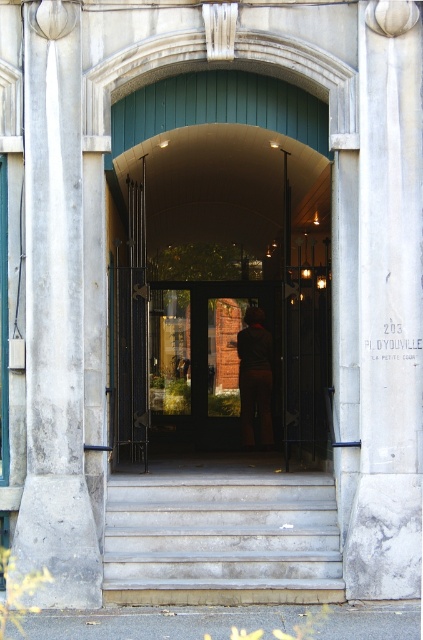
You are a delivery person carrying a large package that is 1 meter wide. You need to enter the building through the arched doorway. Is there enough space between the smooth stone pillar at left and the brown leather jacket at center for your package to fit through?

The smooth stone pillar at left is bigger than the brown leather jacket at center, but the exact distance between them isn

You are a visitor arriving at the building entrance. You see the white marble pillar at right and the brown leather jacket at center. Which object is positioned higher relative to the other?

The white marble pillar at right is located above the brown leather jacket at center, so it is positioned higher.